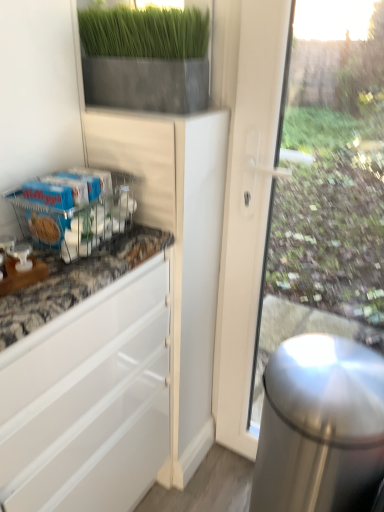
This screenshot has width=384, height=512. What do you see at coordinates (145, 59) in the screenshot?
I see `matte gray planter at upper center` at bounding box center [145, 59].

This screenshot has height=512, width=384. What are the coordinates of `matte gray planter at upper center` in the screenshot? It's located at (145, 59).

What are the coordinates of `polished stainless steel trash can at right` in the screenshot? It's located at pos(320,426).

Identify the location of matte gray planter at upper center. (145, 59).

Is polished stainless steel trash can at right surrounded by metallic wire rack at lower left?

No, polished stainless steel trash can at right is not a part of metallic wire rack at lower left.

Can you tell me how much metallic wire rack at lower left and polished stainless steel trash can at right differ in facing direction?

91 degrees.

Which is farther, [39,222] or [365,498]?

The point [39,222] is behind.

Consider the image. Is metallic wire rack at lower left at the back of polished stainless steel trash can at right?

No, polished stainless steel trash can at right is not facing the opposite direction of metallic wire rack at lower left.

From the image's perspective, does polished stainless steel trash can at right appear lower than metallic wire rack at lower left?

Yes, from the image's perspective, polished stainless steel trash can at right is below metallic wire rack at lower left.

How distant is polished stainless steel trash can at right from metallic wire rack at lower left?

They are 58.44 centimeters apart.

I want to click on appliance in front of the metallic wire rack at lower left, so click(320, 426).

Is matte gray planter at upper center inside or outside of metallic wire rack at lower left?

matte gray planter at upper center exists outside the volume of metallic wire rack at lower left.

Considering the relative sizes of matte gray planter at upper center and metallic wire rack at lower left in the image provided, is matte gray planter at upper center smaller than metallic wire rack at lower left?

No, matte gray planter at upper center is not smaller than metallic wire rack at lower left.

From the image's perspective, is matte gray planter at upper center above or below metallic wire rack at lower left?

matte gray planter at upper center is situated higher than metallic wire rack at lower left in the image.

Can you confirm if metallic wire rack at lower left is taller than matte gray planter at upper center?

Incorrect, the height of metallic wire rack at lower left is not larger of that of matte gray planter at upper center.

Is metallic wire rack at lower left facing away from matte gray planter at upper center?

No.

Identify the location of shelf located on the left of matte gray planter at upper center. This screenshot has height=512, width=384. pyautogui.click(x=75, y=207).

Find the location of `houseplant behind the polished stainless steel trash can at right`. houseplant behind the polished stainless steel trash can at right is located at coordinates (145, 59).

From a real-world perspective, which object rests below the other?

polished stainless steel trash can at right, from a real-world perspective.

From the image's perspective, between matte gray planter at upper center and polished stainless steel trash can at right, which one is located above?

matte gray planter at upper center is shown above in the image.

Between matte gray planter at upper center and polished stainless steel trash can at right, which one has smaller width?

matte gray planter at upper center.

Locate an element on the screen. Image resolution: width=384 pixels, height=512 pixels. houseplant to the left of polished stainless steel trash can at right is located at coordinates (145, 59).

Can you confirm if polished stainless steel trash can at right is thinner than matte gray planter at upper center?

No.

Can you tell me how much polished stainless steel trash can at right and matte gray planter at upper center differ in facing direction?

The angle between the facing direction of polished stainless steel trash can at right and the facing direction of matte gray planter at upper center is 0.735 degrees.

Based on their positions, is polished stainless steel trash can at right located to the left or right of matte gray planter at upper center?

Clearly, polished stainless steel trash can at right is on the right of matte gray planter at upper center in the image.

Locate an element on the screen. The width and height of the screenshot is (384, 512). appliance on the right side of metallic wire rack at lower left is located at coordinates (320, 426).

You are a GUI agent. You are given a task and a screenshot of the screen. Output one action in this format:
    pyautogui.click(x=<x>, y=<y>)
    Task: Click on the appliance below the metallic wire rack at lower left (from a real-world perspective)
    
    Given the screenshot: What is the action you would take?
    pyautogui.click(x=320, y=426)

Based on the photo, looking at the image, which one is located closer to metallic wire rack at lower left, polished stainless steel trash can at right or matte gray planter at upper center?

matte gray planter at upper center is closer to metallic wire rack at lower left.

Looking at the image, which one is located further to polished stainless steel trash can at right, matte gray planter at upper center or metallic wire rack at lower left?

Based on the image, matte gray planter at upper center appears to be further to polished stainless steel trash can at right.

When comparing their distances from matte gray planter at upper center, does polished stainless steel trash can at right or metallic wire rack at lower left seem further?

polished stainless steel trash can at right is positioned further to the anchor matte gray planter at upper center.

Looking at the image, which one is located closer to metallic wire rack at lower left, matte gray planter at upper center or polished stainless steel trash can at right?

Based on the image, matte gray planter at upper center appears to be nearer to metallic wire rack at lower left.

From the image, which object appears to be nearer to polished stainless steel trash can at right, metallic wire rack at lower left or matte gray planter at upper center?

The object closer to polished stainless steel trash can at right is metallic wire rack at lower left.

Based on their spatial positions, is metallic wire rack at lower left or polished stainless steel trash can at right closer to matte gray planter at upper center?

metallic wire rack at lower left lies closer to matte gray planter at upper center than the other object.

Locate an element on the screen. shelf between matte gray planter at upper center and polished stainless steel trash can at right in the vertical direction is located at coordinates (75, 207).